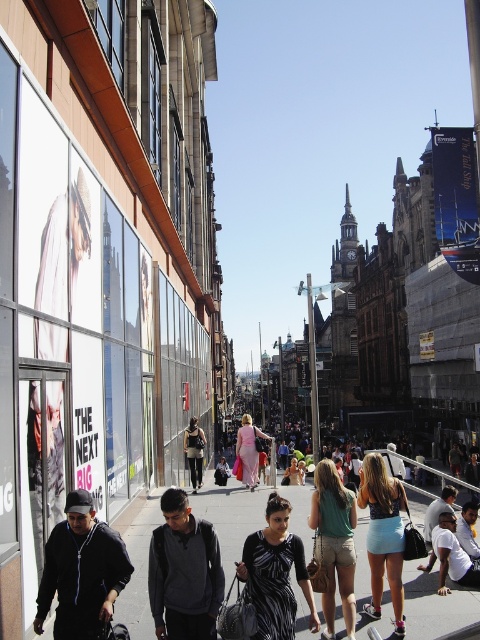
Between point (52, 540) and point (160, 580), which one is positioned in front?

Point (52, 540) is in front.

Can you confirm if black hoodie at lower left is positioned to the right of dark gray sweater at center?

In fact, black hoodie at lower left is to the left of dark gray sweater at center.

Is point (120, 554) farther from camera compared to point (203, 580)?

No, (120, 554) is in front of (203, 580).

Where is `black hoodie at lower left`? The width and height of the screenshot is (480, 640). black hoodie at lower left is located at coordinates tap(82, 572).

Does black hoodie at lower left appear on the left side of light pink fabric dress at center?

Yes, black hoodie at lower left is to the left of light pink fabric dress at center.

What do you see at coordinates (82, 572) in the screenshot? I see `black hoodie at lower left` at bounding box center [82, 572].

Where is `black hoodie at lower left`? The image size is (480, 640). black hoodie at lower left is located at coordinates (82, 572).

Which is more to the left, black and white striped dress at center or blue denim shorts at center?

black and white striped dress at center is more to the left.

Looking at this image, who is taller, black and white striped dress at center or blue denim shorts at center?

Standing taller between the two is blue denim shorts at center.

This screenshot has width=480, height=640. I want to click on black and white striped dress at center, so click(276, 573).